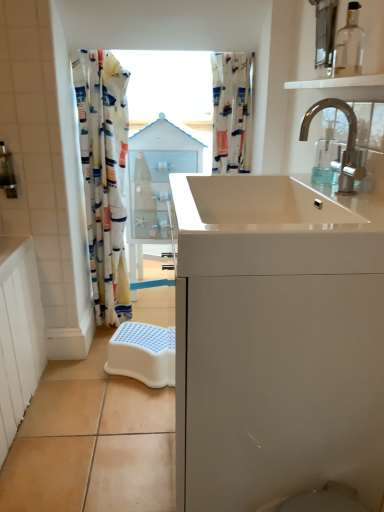
Identify the location of white fabric curtain at left. The image size is (384, 512). (104, 177).

This screenshot has height=512, width=384. Describe the element at coordinates (155, 184) in the screenshot. I see `white glossy medicine cabinet at center` at that location.

The image size is (384, 512). I want to click on white plastic stool at lower left, so click(143, 353).

The width and height of the screenshot is (384, 512). Describe the element at coordinates (327, 157) in the screenshot. I see `clear plastic soap dispenser at upper right` at that location.

Where is `transparent glass bottle at upper right`? transparent glass bottle at upper right is located at coordinates (349, 45).

Image resolution: width=384 pixels, height=512 pixels. What do you see at coordinates (252, 204) in the screenshot? I see `white glossy sink at center` at bounding box center [252, 204].

This screenshot has width=384, height=512. Find the location of `white fabric shower curtain at upper center`. white fabric shower curtain at upper center is located at coordinates (232, 111).

Find the location of a particular element. The image size is (384, 512). sink below the chrome metallic faucet at upper right (from a real-world perspective) is located at coordinates (252, 204).

Between point (353, 145) and point (300, 203), which one is positioned behind?

Point (300, 203)

Which of these two, chrome metallic faucet at upper right or white glossy sink at center, stands taller?

With more height is chrome metallic faucet at upper right.

From the picture: Does chrome metallic faucet at upper right have a greater width compared to white glossy sink at center?

No.

Which object is positioned more to the right, transparent glass bottle at upper right or white plastic stool at lower left?

transparent glass bottle at upper right is more to the right.

Is transparent glass bottle at upper right taller or shorter than white plastic stool at lower left?

transparent glass bottle at upper right is taller than white plastic stool at lower left.

Are transparent glass bottle at upper right and white plastic stool at lower left making contact?

No, transparent glass bottle at upper right is not next to white plastic stool at lower left.

Can you tell me how much transparent glass bottle at upper right and white plastic stool at lower left differ in facing direction?

The angle between the facing direction of transparent glass bottle at upper right and the facing direction of white plastic stool at lower left is 61.8 degrees.

Can you tell me how much white plastic stool at lower left and white fabric curtain at left differ in facing direction?

27.5 degrees separate the facing orientations of white plastic stool at lower left and white fabric curtain at left.

From the image's perspective, is white plastic stool at lower left on white fabric curtain at left?

Incorrect, from the image's perspective, white plastic stool at lower left is lower than white fabric curtain at left.

Is white plastic stool at lower left wider or thinner than white fabric curtain at left?

white plastic stool at lower left is wider than white fabric curtain at left.

Is white plastic stool at lower left looking in the opposite direction of white fabric curtain at left?

No, white plastic stool at lower left's orientation is not away from white fabric curtain at left.

Is there a large distance between transparent glass shelf at upper right and white fabric shower curtain at upper center?

transparent glass shelf at upper right is near white fabric shower curtain at upper center, not far away.

From a real-world perspective, between transparent glass shelf at upper right and white fabric shower curtain at upper center, who is vertically lower?

white fabric shower curtain at upper center, from a real-world perspective.

Could you tell me if transparent glass shelf at upper right is facing white fabric shower curtain at upper center?

No, transparent glass shelf at upper right is not oriented towards white fabric shower curtain at upper center.

The height and width of the screenshot is (512, 384). Find the location of `shower curtain above the transparent glass shelf at upper right (from the image's perspective)`. shower curtain above the transparent glass shelf at upper right (from the image's perspective) is located at coordinates (232, 111).

From the image's perspective, would you say transparent glass bottle at upper right is shown under transparent glass shelf at upper right?

No, from the image's perspective, transparent glass bottle at upper right is not beneath transparent glass shelf at upper right.

Which is behind, transparent glass bottle at upper right or transparent glass shelf at upper right?

transparent glass bottle at upper right is further away from the camera.

From a real-world perspective, which object rests below the other?

transparent glass shelf at upper right.

From their relative heights in the image, would you say transparent glass bottle at upper right is taller or shorter than transparent glass shelf at upper right?

Considering their sizes, transparent glass bottle at upper right has more height than transparent glass shelf at upper right.

In the image, there is a transparent glass bottle at upper right. What are the coordinates of `tap below it (from a real-world perspective)` in the screenshot? It's located at (347, 142).

How far apart are chrome metallic faucet at upper right and transparent glass bottle at upper right?

chrome metallic faucet at upper right and transparent glass bottle at upper right are 6.76 inches apart from each other.

From a real-world perspective, relative to transparent glass bottle at upper right, is chrome metallic faucet at upper right vertically above or below?

chrome metallic faucet at upper right is situated lower than transparent glass bottle at upper right in the real world.

Between chrome metallic faucet at upper right and transparent glass bottle at upper right, which one has larger width?

chrome metallic faucet at upper right is wider.

Is the position of transparent glass bottle at upper right less distant than that of chrome metallic faucet at upper right?

No.

From the picture: Who is smaller, transparent glass bottle at upper right or chrome metallic faucet at upper right?

transparent glass bottle at upper right is smaller.

Which of these two, transparent glass bottle at upper right or chrome metallic faucet at upper right, is wider?

chrome metallic faucet at upper right.

From a real-world perspective, does transparent glass bottle at upper right sit lower than chrome metallic faucet at upper right?

Incorrect, from a real-world perspective, transparent glass bottle at upper right is higher than chrome metallic faucet at upper right.

This screenshot has height=512, width=384. In order to click on sink in front of the chrome metallic faucet at upper right in this screenshot , I will do `click(252, 204)`.

Find the location of a particular element. bottle above the white plastic stool at lower left (from a real-world perspective) is located at coordinates (349, 45).

Estimate the real-world distances between objects in this image. Which object is closer to transparent glass shelf at upper right, white fabric shower curtain at upper center or clear plastic soap dispenser at upper right?

clear plastic soap dispenser at upper right.

Consider the image. Based on their spatial positions, is white fabric shower curtain at upper center or white glossy sink at center closer to transparent glass shelf at upper right?

The object closer to transparent glass shelf at upper right is white glossy sink at center.

Looking at this image, based on their spatial positions, is transparent glass shelf at upper right or white glossy sink at center closer to transparent glass bottle at upper right?

transparent glass shelf at upper right lies closer to transparent glass bottle at upper right than the other object.

From the image, which object appears to be nearer to white plastic stool at lower left, white fabric curtain at left or white fabric shower curtain at upper center?

white fabric curtain at left lies closer to white plastic stool at lower left than the other object.

Considering their positions, is white glossy sink at center positioned further to chrome metallic faucet at upper right than white plastic stool at lower left?

white plastic stool at lower left.

Estimate the real-world distances between objects in this image. Which object is further from chrome metallic faucet at upper right, white plastic stool at lower left or white glossy medicine cabinet at center?

white plastic stool at lower left lies further to chrome metallic faucet at upper right than the other object.

When comparing their distances from white glossy sink at center, does white fabric curtain at left or clear plastic soap dispenser at upper right seem closer?

clear plastic soap dispenser at upper right lies closer to white glossy sink at center than the other object.

Estimate the real-world distances between objects in this image. Which object is closer to white glossy medicine cabinet at center, transparent glass bottle at upper right or transparent glass shelf at upper right?

Based on the image, transparent glass shelf at upper right appears to be nearer to white glossy medicine cabinet at center.

This screenshot has height=512, width=384. I want to click on tap between white fabric shower curtain at upper center and white plastic stool at lower left from top to bottom, so click(x=347, y=142).

Find the location of a particular element. stool positioned between chrome metallic faucet at upper right and white fabric curtain at left from near to far is located at coordinates (143, 353).

Identify the location of shower curtain located between white fabric curtain at left and clear plastic soap dispenser at upper right in the left-right direction. (232, 111).

The height and width of the screenshot is (512, 384). Identify the location of tap located between transparent glass shelf at upper right and white plastic stool at lower left in the depth direction. (347, 142).